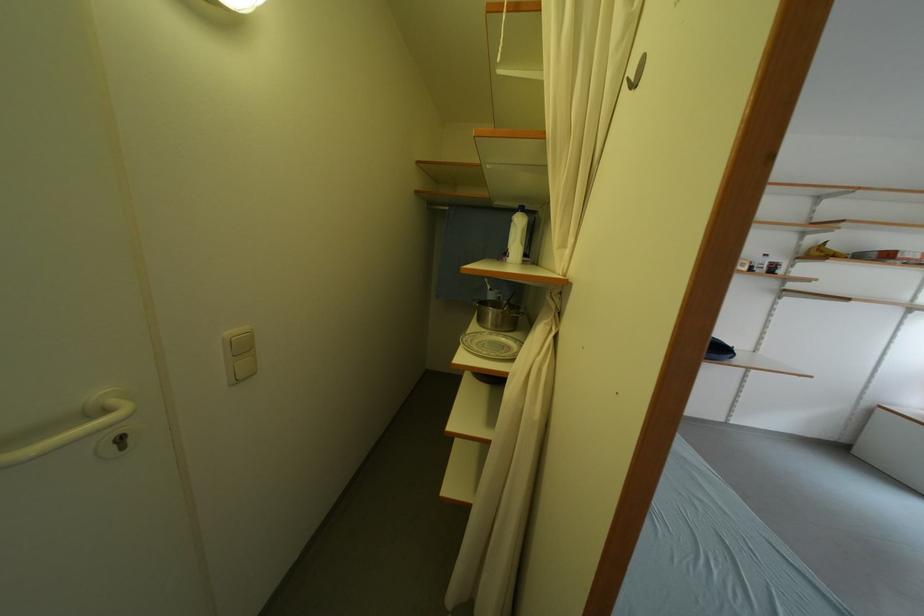
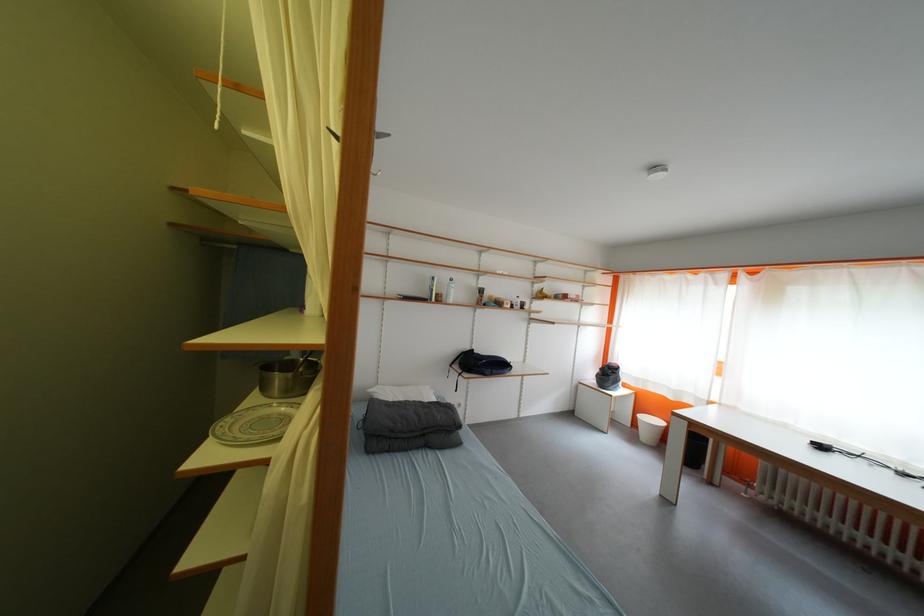
In the second image, find the point that corresponds to point 500,317 in the first image.

(286, 382)